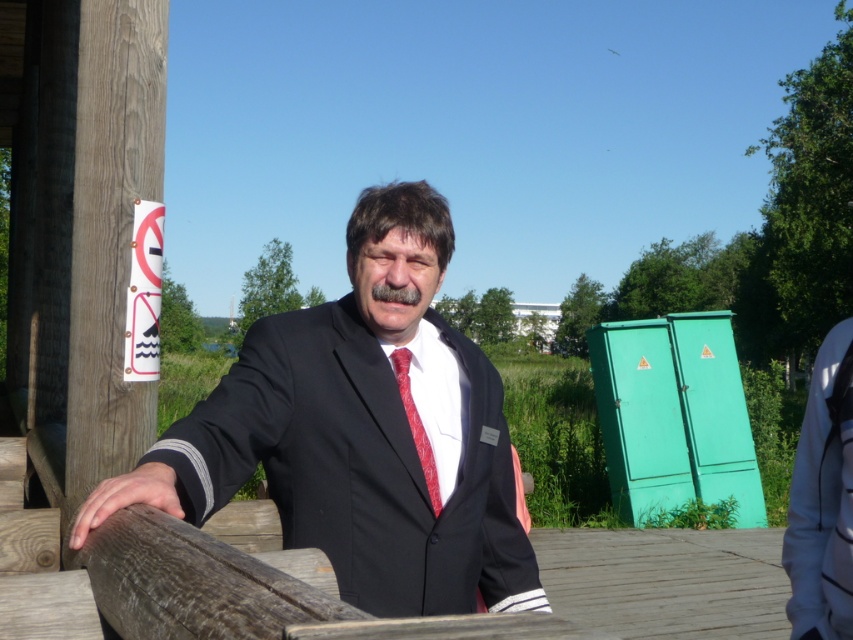
You are a photographer setting up a shoot on a wooden deck. You have a matte black suit at center and a white fabric at right. Which object is covering the other one?

The matte black suit at center is positioned over white fabric at right, so it is covering the white fabric at right.

You are a photographer positioned behind the man and want to capture both the matte black suit at center and the red satin tie at center in a single focused shot. Since the camera can only focus on one object at a time, which object should you choose to ensure the other is still somewhat in focus?

The matte black suit at center is closer to the viewer than the red satin tie at center. To ensure both are somewhat in focus, you should focus on the matte black suit at center because it is closer, and the red satin tie at center will be slightly out of focus but still recognizable.